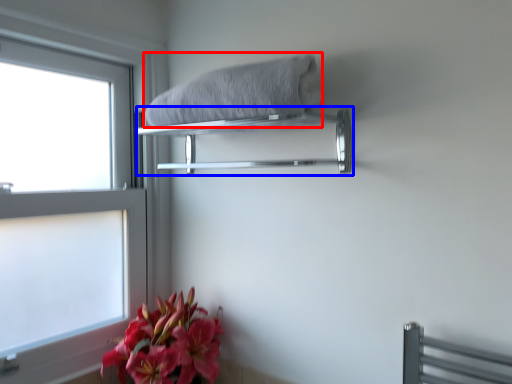
Question: Among these objects, which one is farthest to the camera, bath towel (highlighted by a red box) or balustrade (highlighted by a blue box)?

Choices:
 (A) bath towel
 (B) balustrade

Answer: (B)